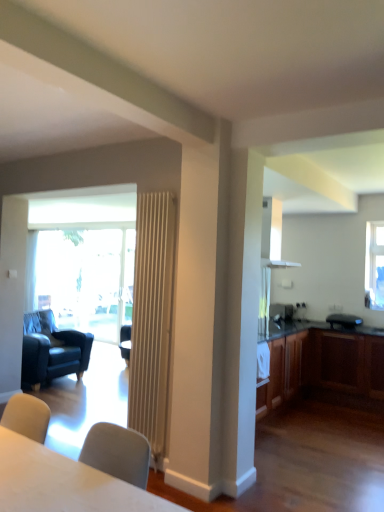
Question: Would you say wooden cabinet at right is inside or outside satin silver microwave at right?

Choices:
 (A) outside
 (B) inside

Answer: (A)

Question: Is wooden cabinet at right in front of or behind satin silver microwave at right in the image?

Choices:
 (A) behind
 (B) front

Answer: (B)

Question: Estimate the real-world distances between objects in this image. Which object is farther from the clear glass window at upper right?

Choices:
 (A) satin silver microwave at right
 (B) wooden cabinet at right
 (C) dark blue leather armchair at left
 (D) wooden radiator at center
 (E) white matte table at lower left

Answer: (E)

Question: Which of these objects is positioned closest to the wooden cabinet at right?

Choices:
 (A) wooden radiator at center
 (B) clear glass window at upper right
 (C) satin silver microwave at right
 (D) white matte table at lower left
 (E) dark blue leather armchair at left

Answer: (C)